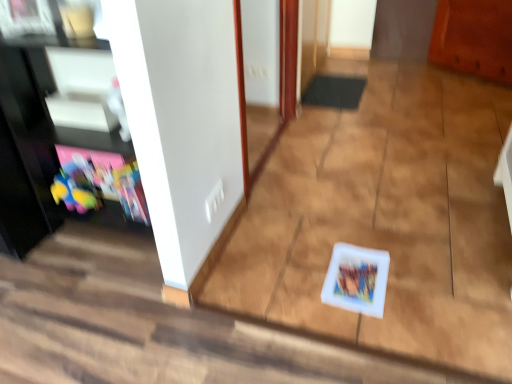
You are a GUI agent. You are given a task and a screenshot of the screen. Output one action in this format:
    pyautogui.click(x=<x>, y=<y>)
    Task: Click on the vacant space that is in between black glossy entertainment center at left and white matte card game at center
    The width and height of the screenshot is (512, 384).
    Given the screenshot: What is the action you would take?
    pyautogui.click(x=274, y=259)